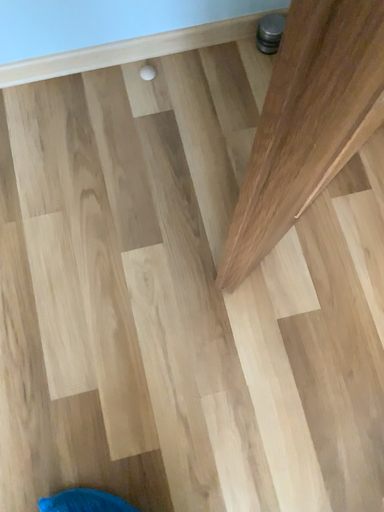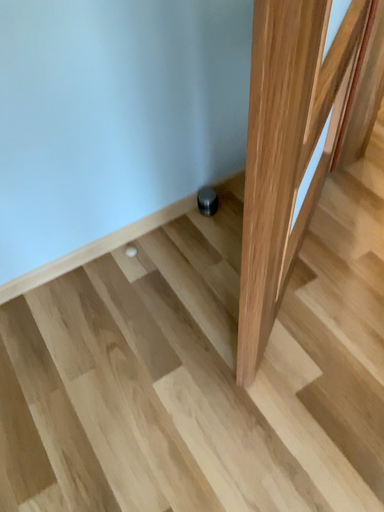
Question: How did the camera likely rotate when shooting the video?

Choices:
 (A) rotated upward
 (B) rotated downward

Answer: (A)